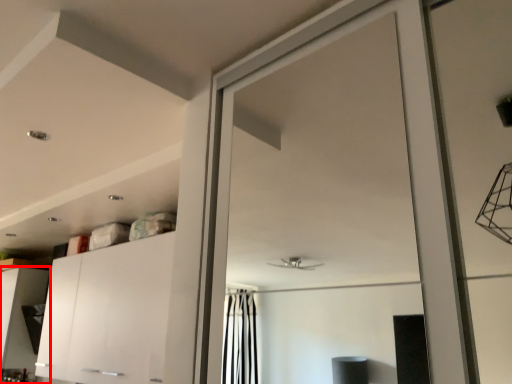
Question: From the image's perspective, where is cabinetry (annotated by the red box) located in relation to cabinetry in the image?

Choices:
 (A) below
 (B) above

Answer: (A)